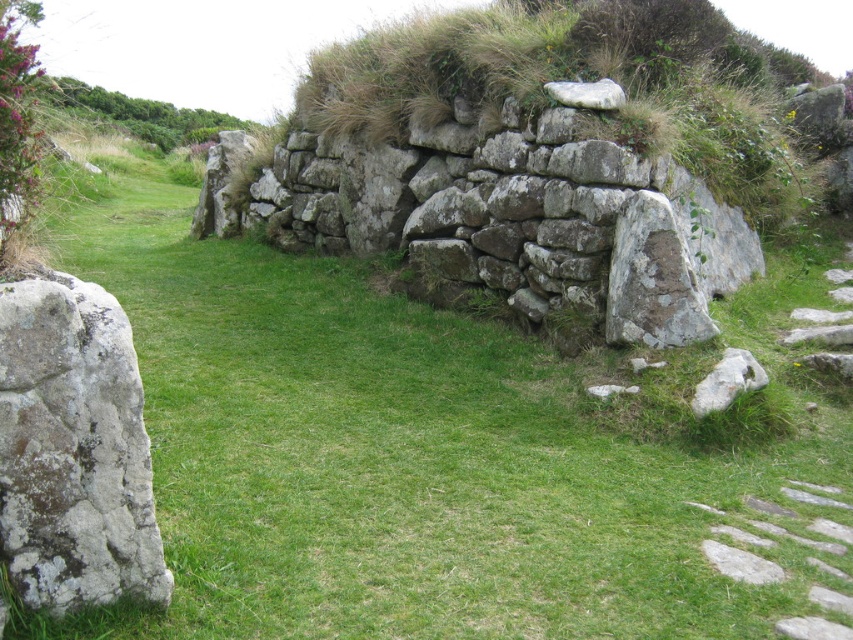
The image size is (853, 640). I want to click on rusty metallic rock at lower right, so click(727, 381).

Can you confirm if rusty metallic rock at lower right is smaller than white smooth rock at upper center?

Incorrect, rusty metallic rock at lower right is not smaller in size than white smooth rock at upper center.

The width and height of the screenshot is (853, 640). Describe the element at coordinates (727, 381) in the screenshot. I see `rusty metallic rock at lower right` at that location.

You are a GUI agent. You are given a task and a screenshot of the screen. Output one action in this format:
    pyautogui.click(x=<x>, y=<y>)
    Task: Click on the rusty metallic rock at lower right
    The width and height of the screenshot is (853, 640).
    Given the screenshot: What is the action you would take?
    pyautogui.click(x=727, y=381)

Which is behind, point (616, 282) or point (712, 380)?

The point (616, 282) is more distant.

Is point (303, 182) closer to camera compared to point (756, 387)?

No, it is not.

Is point (621, 164) behind point (729, 360)?

Yes, point (621, 164) is behind point (729, 360).

Image resolution: width=853 pixels, height=640 pixels. In order to click on natural stone wall at center in this screenshot , I will do `click(521, 220)`.

Who is positioned more to the right, natural stone wall at center or white smooth rock at upper center?

From the viewer's perspective, white smooth rock at upper center appears more on the right side.

Is natural stone wall at center to the left of white smooth rock at upper center from the viewer's perspective?

Indeed, natural stone wall at center is positioned on the left side of white smooth rock at upper center.

You are a GUI agent. You are given a task and a screenshot of the screen. Output one action in this format:
    pyautogui.click(x=<x>, y=<y>)
    Task: Click on the natural stone wall at center
    
    Given the screenshot: What is the action you would take?
    pyautogui.click(x=521, y=220)

Locate an element on the screen. Image resolution: width=853 pixels, height=640 pixels. natural stone wall at center is located at coordinates (521, 220).